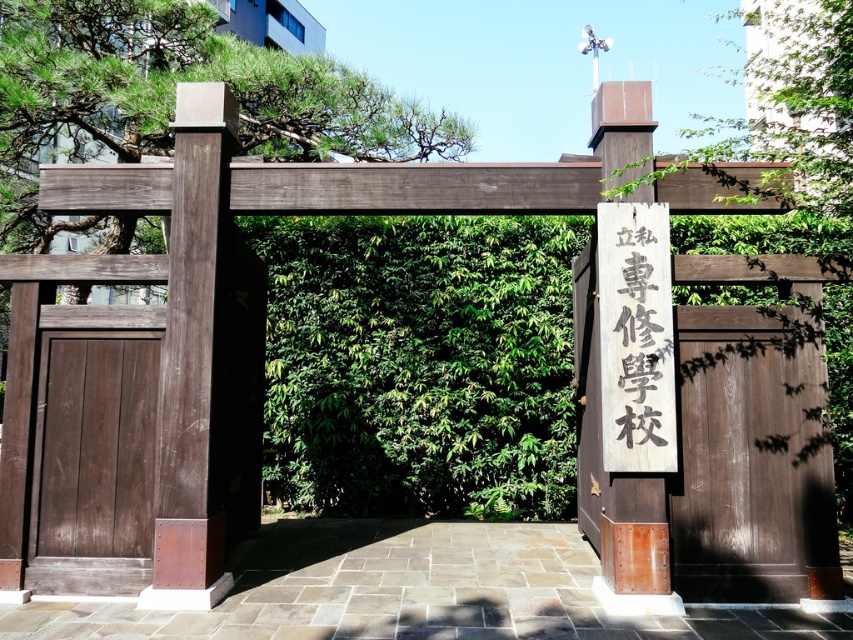
You are a visitor arriving at the school and need to enter through the gate. The gate has two doors. You notice a brown wooden door at center and a dark brown wood door at left. Which door should you open first according to typical gate entrance procedures?

According to typical gate entrance procedures, you should open the dark brown wood door at left first because the brown wooden door at center is above it and likely the upper part of the gate, making the lower dark brown wood door at left the accessible entrance.

You are standing in front of the gate of a private specialized school. You see a dark brown wood door at left and a green leafy tree at center. Which object is closer to the ground?

The dark brown wood door at left is closer to the ground because it is below the green leafy tree at center.